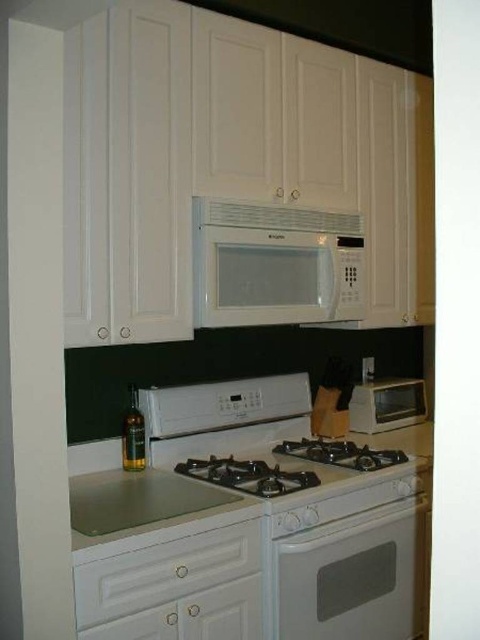
Question: Estimate the real-world distances between objects in this image. Which object is closer to the green glass stove at center?

Choices:
 (A) white plastic toaster oven at center
 (B) white glossy microwave at center
 (C) white textured exhaust hood at upper center
 (D) white glossy oven at center

Answer: (D)

Question: Which point is farther to the camera?

Choices:
 (A) white textured exhaust hood at upper center
 (B) white glossy gas stove at center
 (C) transparent glass sink at center
 (D) green glass stove at center

Answer: (A)

Question: Is transparent glass sink at center to the right of white textured exhaust hood at upper center from the viewer's perspective?

Choices:
 (A) yes
 (B) no

Answer: (B)

Question: Does white glossy oven at center lie behind green glass stove at center?

Choices:
 (A) yes
 (B) no

Answer: (A)

Question: Which point is farther from the camera taking this photo?

Choices:
 (A) (87, 520)
 (B) (376, 468)
 (C) (195, 326)

Answer: (B)

Question: Can you confirm if transparent glass sink at center is positioned below white plastic toaster oven at center?

Choices:
 (A) no
 (B) yes

Answer: (B)